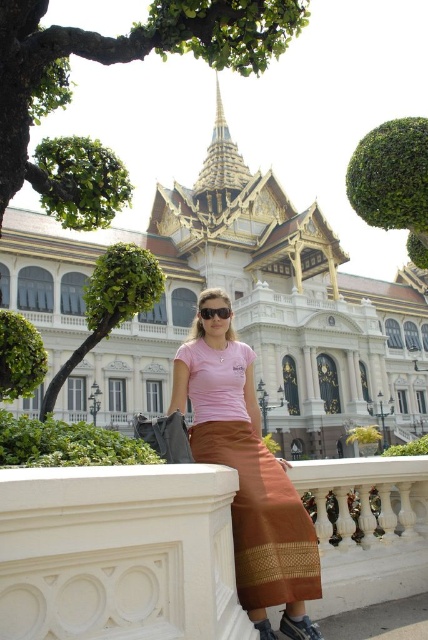
Question: Which object appears farthest from the camera in this image?

Choices:
 (A) pink fabric skirt at center
 (B) white marble ledge at lower center
 (C) gold metallic palace at center
 (D) black matte sunglasses at center

Answer: (C)

Question: Is white marble ledge at lower center to the right of black matte sunglasses at center from the viewer's perspective?

Choices:
 (A) yes
 (B) no

Answer: (A)

Question: Is gold metallic palace at center wider than white marble ledge at lower center?

Choices:
 (A) yes
 (B) no

Answer: (A)

Question: Is white marble ledge at lower center thinner than black matte sunglasses at center?

Choices:
 (A) no
 (B) yes

Answer: (A)

Question: Among these points, which one is nearest to the camera?

Choices:
 (A) (305, 596)
 (B) (220, 312)
 (C) (104, 246)
 (D) (136, 600)

Answer: (D)

Question: Among these points, which one is farthest from the camera?

Choices:
 (A) (270, 541)
 (B) (201, 314)
 (C) (232, 269)

Answer: (C)